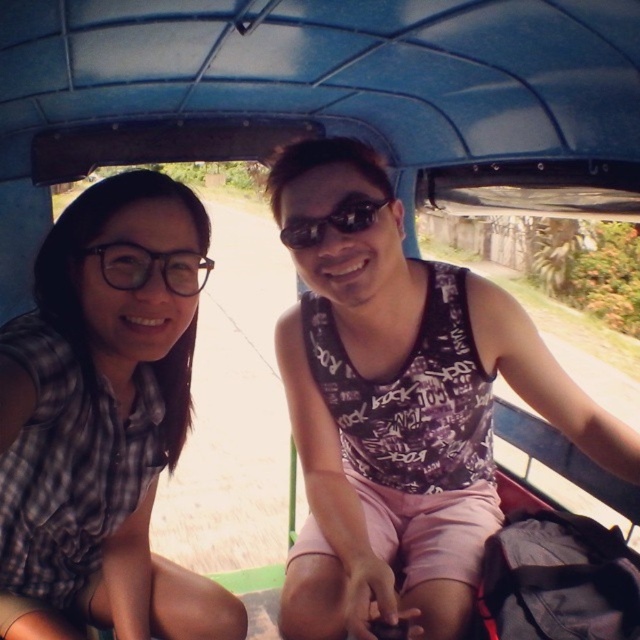
Consider the image. You are a passenger in a vehicle and want to know if the point at coordinate (x=97, y=221) is closer to you than the point at (x=115, y=275). Based on the scene, can you determine this?

Yes, the point at coordinate (x=97, y=221) is closer to you than the point at (x=115, y=275) because it is further to the camera, which means it is nearer to the observer.

You are a photographer standing outside the tuk tuk. You need to capture a photo of both the plaid fabric shirt at left and the sunglasses at center. Which object should you adjust your focus to ensure it appears larger in the photo?

The plaid fabric shirt at left is much taller than the sunglasses at center, so you should focus on the plaid fabric shirt at left to ensure it appears larger in the photo.